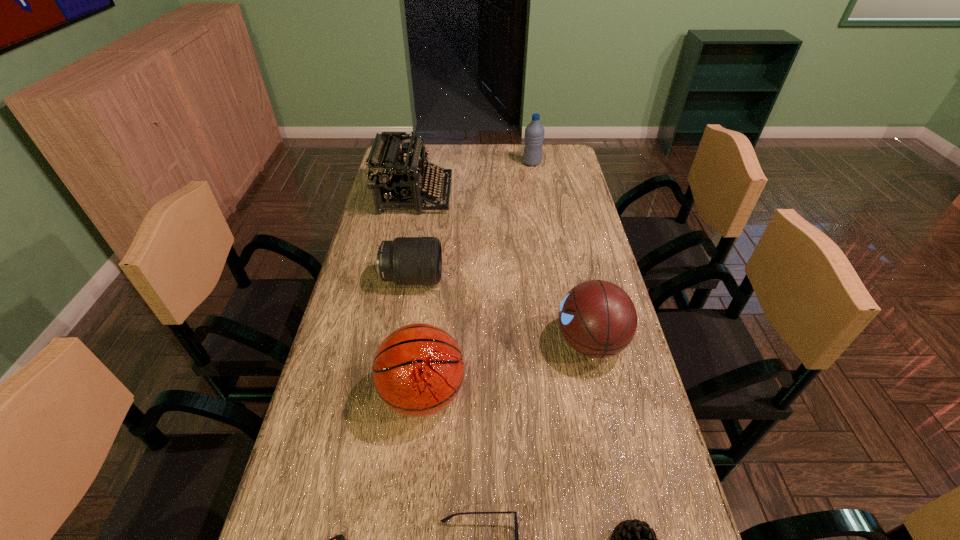
Locate an element on the screen. vacant region at the far edge of the desktop is located at coordinates (435, 151).

In the image, there is a desktop. Identify the location of vacant space at the left edge. The image size is (960, 540). (319, 525).

At what (x,y) coordinates should I click in order to perform the action: click on free space at the right edge of the desktop. Please return your answer as a coordinate pair (x, y). This screenshot has width=960, height=540. Looking at the image, I should click on (562, 193).

In the image, there is a desktop. Where is `vacant space at the far right corner`? The width and height of the screenshot is (960, 540). vacant space at the far right corner is located at coordinates (564, 169).

The width and height of the screenshot is (960, 540). Identify the location of vacant space in between the right basketball and the farthest object. (562, 252).

The width and height of the screenshot is (960, 540). Find the location of `empty space that is in between the left basketball and the second farthest object`. empty space that is in between the left basketball and the second farthest object is located at coordinates (420, 295).

Identify which object is the nearest to the third shortest object. Please provide its 2D coordinates. Your answer should be formatted as a tuple, i.e. [(x, y)], where the tuple contains the x and y coordinates of a point satisfying the conditions above.

[(444, 520)]

Find the location of a particular element. The height and width of the screenshot is (540, 960). the seventh closest object to the pinecone is located at coordinates (534, 133).

Identify the location of free spot that satisfies the following two spatial constraints: 1. on the front side of the water bottle; 2. on the typing side of the typewriter. coord(538,195).

You are a GUI agent. You are given a task and a screenshot of the screen. Output one action in this format:
    pyautogui.click(x=<x>, y=<y>)
    Task: Click on the free spot that satisfies the following two spatial constraints: 1. on the typing side of the right basketball; 2. on the right side of the typewriter
    
    Given the screenshot: What is the action you would take?
    pyautogui.click(x=388, y=342)